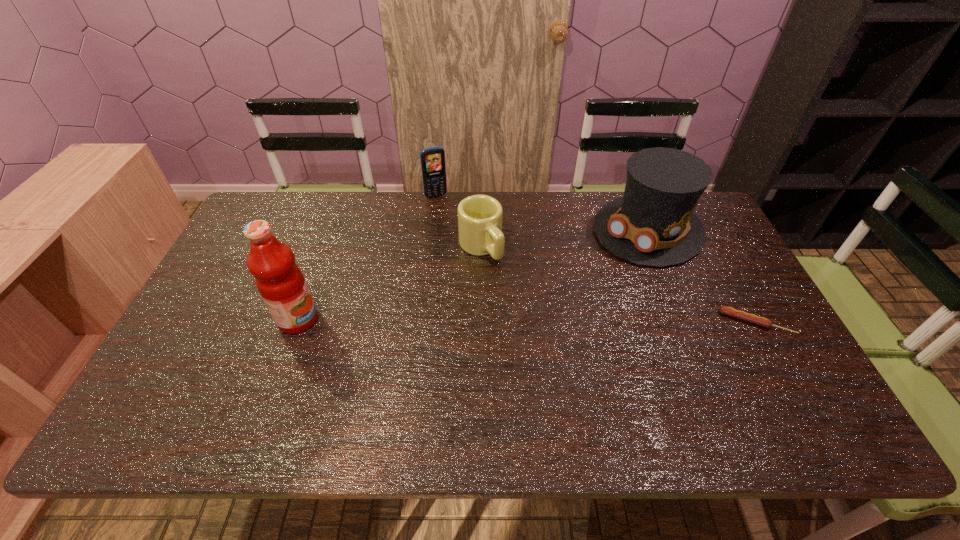
Image resolution: width=960 pixels, height=540 pixels. I want to click on vacant area at the far right corner, so click(700, 205).

Identify the location of unoccupied position between the fourth object from right to left and the tallest object. pyautogui.click(x=367, y=258).

Identify the location of unoccupied area between the fourth shortest object and the sausage. (702, 276).

The height and width of the screenshot is (540, 960). Identify the location of vacant space in between the sausage and the fourth object from right to left. (596, 259).

Identify the location of free point between the shortest object and the mug. (618, 285).

In order to click on unoccupied area between the leftmost object and the third object from left to right in this screenshot , I will do `click(390, 283)`.

Where is `free space between the third tallest object and the fruit juice`? The width and height of the screenshot is (960, 540). free space between the third tallest object and the fruit juice is located at coordinates (367, 258).

The image size is (960, 540). Identify the location of vacant space in between the shortest object and the mug. (618, 285).

The height and width of the screenshot is (540, 960). In order to click on free spot between the third shortest object and the dress hat in this screenshot , I will do `click(542, 213)`.

Where is `the fourth closest object relative to the dress hat`? the fourth closest object relative to the dress hat is located at coordinates (279, 280).